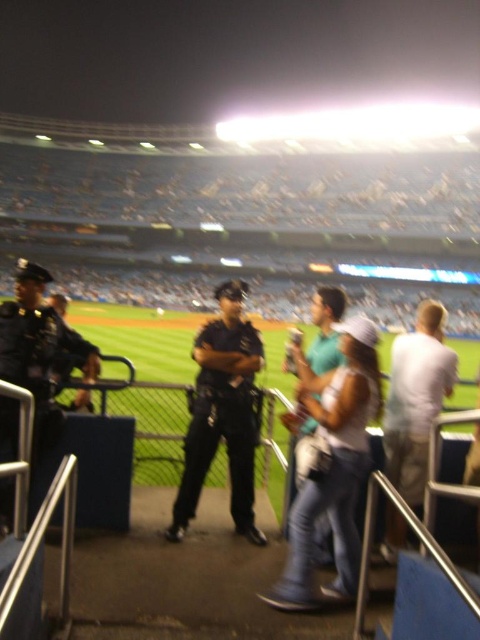
You are a photographer trying to capture both the dark blue uniform at left and the teal fabric shirt at center in a single shot. Given their sizes, which one would appear bigger in the photo?

The dark blue uniform at left appears bigger in the photo because it has a larger size compared to the teal fabric shirt at center.